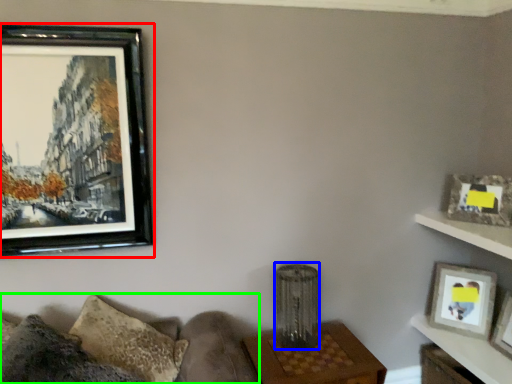
Question: Which object is positioned farthest from picture frame (highlighted by a red box)? Select from lamp (highlighted by a blue box) and couch (highlighted by a green box).

Choices:
 (A) lamp
 (B) couch

Answer: (A)